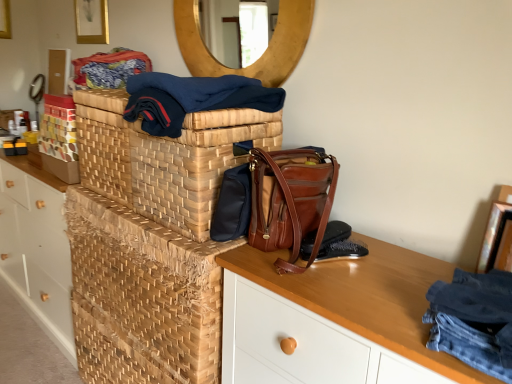
The height and width of the screenshot is (384, 512). Find the location of `free point behind denim jeans at right, which ranks as the first clothing in front-to-back order`. free point behind denim jeans at right, which ranks as the first clothing in front-to-back order is located at coordinates (395, 285).